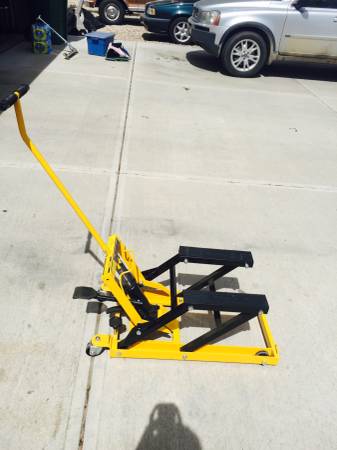
Find the location of `storage`. storage is located at coordinates (96, 38).